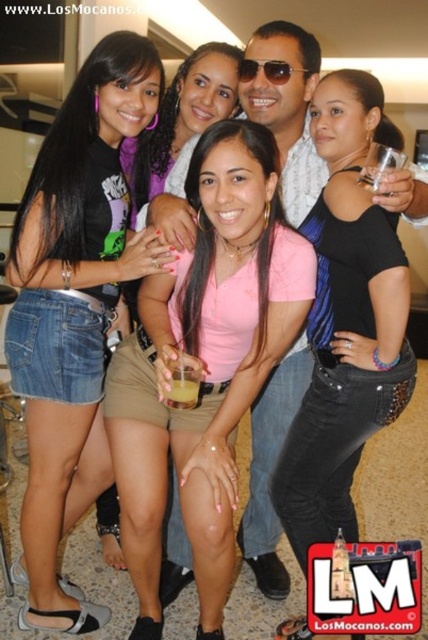
Question: Does black shiny tank top at center have a larger size compared to pink matte shirt at center?

Choices:
 (A) no
 (B) yes

Answer: (B)

Question: Which of these objects is positioned closest to the black shiny tank top at center?

Choices:
 (A) pink matte shirt at center
 (B) denim shorts at left
 (C) yellow translucent cup at center
 (D) sunglasses at center

Answer: (C)

Question: Is denim shorts at left positioned before sunglasses at center?

Choices:
 (A) yes
 (B) no

Answer: (A)

Question: Based on their relative distances, which object is nearer to the sunglasses at center?

Choices:
 (A) pink matte shirt at center
 (B) denim shorts at left
 (C) black shiny tank top at center
 (D) yellow translucent cup at center

Answer: (A)

Question: Among these objects, which one is farthest from the camera?

Choices:
 (A) yellow translucent cup at center
 (B) pink matte shirt at center

Answer: (B)

Question: Is denim shorts at left above pink matte shirt at center?

Choices:
 (A) no
 (B) yes

Answer: (A)